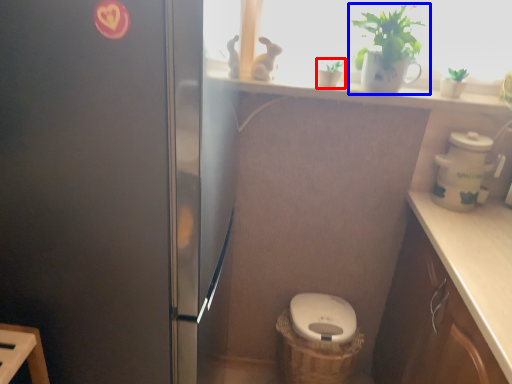
Question: Which object appears closest to the camera in this image, houseplant (highlighted by a red box) or houseplant (highlighted by a blue box)?

Choices:
 (A) houseplant
 (B) houseplant

Answer: (B)